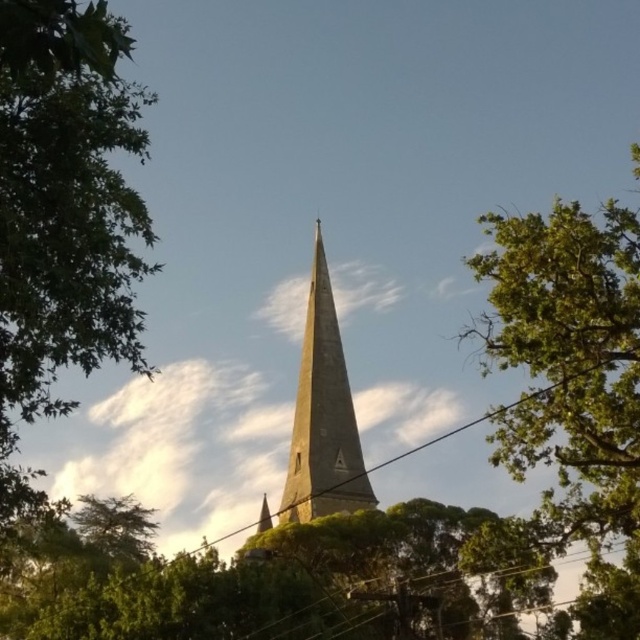
You are standing in front of the church spire and notice two points marked in the image. The first point is at coordinates point (140, 324) and the second is at point (592, 355). Which point is closer to you?

Point (140, 324) is closer to you because it is in front of point (592, 355).

You are a bird looking for a place to perch. You can choose between the green leafy tree at left and the smooth stone spire at center. Which one has a wider structure for you to land on?

The green leafy tree at left has a wider structure than the smooth stone spire at center, so it is better for landing.